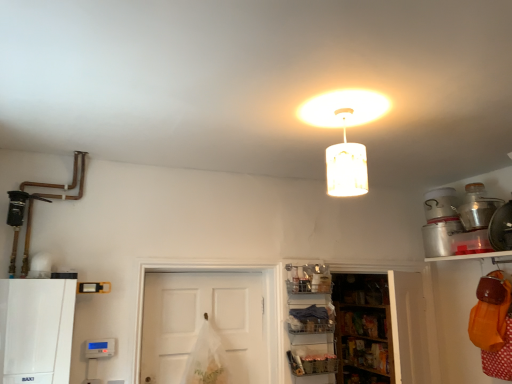
Question: From a real-world perspective, relative to wooden shelves at lower center, the third shelf in the left-to-right sequence, is metallic silver shelf at lower right, marked as the 3th shelf in a right-to-left arrangement, vertically above or below?

Choices:
 (A) above
 (B) below

Answer: (B)

Question: Would you say metallic silver shelf at lower right, marked as the 3th shelf in a right-to-left arrangement, is inside or outside wooden shelves at lower center, the third shelf in the left-to-right sequence?

Choices:
 (A) inside
 (B) outside

Answer: (B)

Question: Which is farther from the white matte lampshade at upper center?

Choices:
 (A) metallic silver container at upper right
 (B) white matte door at center
 (C) metallic silver shelf at lower right, marked as the 3th shelf in a right-to-left arrangement
 (D) white matte cabinet at lower left
 (E) wooden shelves at lower center, the third shelf in the left-to-right sequence

Answer: (E)

Question: Which object is positioned farthest from the orange fabric bag at lower right, which ranks as the 4th shelf in left-to-right order?

Choices:
 (A) white matte cabinet at lower left
 (B) metallic silver container at upper right
 (C) metallic silver shelf at lower right, marked as the 3th shelf in a right-to-left arrangement
 (D) white matte lampshade at upper center
 (E) white matte door at center

Answer: (A)